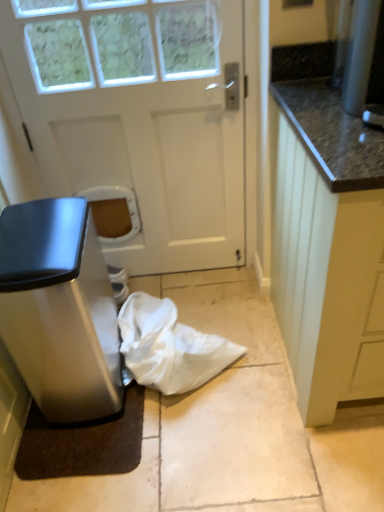
Question: Is white matte door at center taller than white fabric bag at lower center?

Choices:
 (A) no
 (B) yes

Answer: (B)

Question: From the image's perspective, is white matte door at center under white fabric bag at lower center?

Choices:
 (A) yes
 (B) no

Answer: (B)

Question: Would you consider white matte door at center to be distant from white fabric bag at lower center?

Choices:
 (A) no
 (B) yes

Answer: (A)

Question: From the image's perspective, is white matte door at center above white fabric bag at lower center?

Choices:
 (A) no
 (B) yes

Answer: (B)

Question: Does white matte door at center lie in front of white fabric bag at lower center?

Choices:
 (A) yes
 (B) no

Answer: (A)

Question: Can we say white matte door at center lies outside white fabric bag at lower center?

Choices:
 (A) yes
 (B) no

Answer: (A)

Question: Would you consider white wood cabinet at right to be distant from white matte door at center?

Choices:
 (A) yes
 (B) no

Answer: (B)

Question: Is white wood cabinet at right smaller than white matte door at center?

Choices:
 (A) yes
 (B) no

Answer: (B)

Question: Is white wood cabinet at right taller than white matte door at center?

Choices:
 (A) yes
 (B) no

Answer: (B)

Question: Does white wood cabinet at right have a lesser width compared to white matte door at center?

Choices:
 (A) yes
 (B) no

Answer: (B)

Question: Is white wood cabinet at right behind white matte door at center?

Choices:
 (A) yes
 (B) no

Answer: (B)

Question: Is white matte door at center located within white wood cabinet at right?

Choices:
 (A) no
 (B) yes

Answer: (A)

Question: Could you tell me if satin silver trash can at left is facing white wood cabinet at right?

Choices:
 (A) yes
 (B) no

Answer: (B)